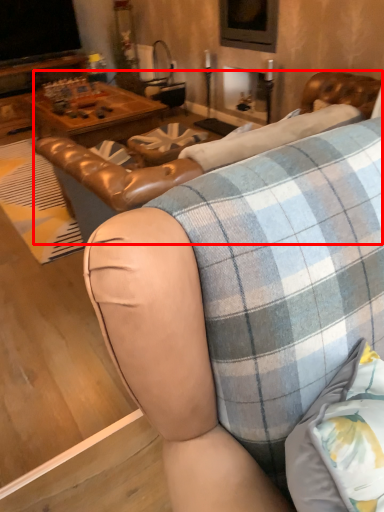
Question: From the image's perspective, where is swivel chair (annotated by the red box) located relative to studio couch?

Choices:
 (A) below
 (B) above

Answer: (A)